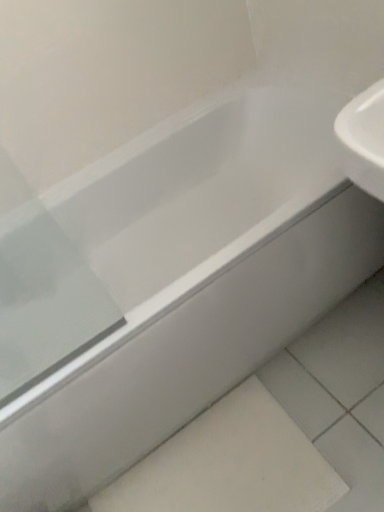
Where is `free location above white matte ceramic tile at lower center (from a real-world perspective)`? free location above white matte ceramic tile at lower center (from a real-world perspective) is located at coordinates (215, 473).